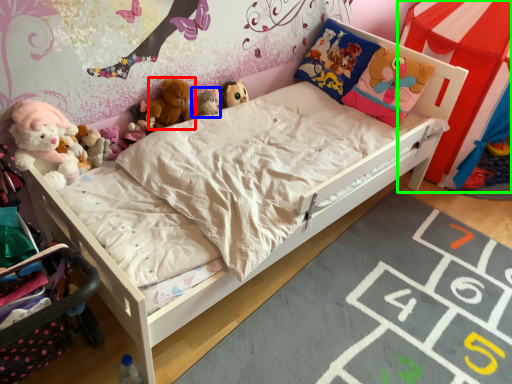
Question: Considering the real-world distances, which object is farthest from toy (highlighted by a red box)? toy (highlighted by a blue box) or canopy bed (highlighted by a green box)?

Choices:
 (A) toy
 (B) canopy bed

Answer: (B)